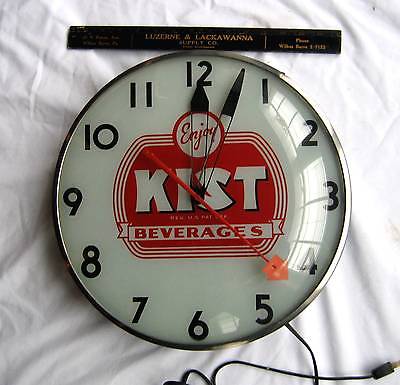
Identify the location of cord. This screenshot has width=400, height=385. (284, 370), (309, 349), (352, 376).